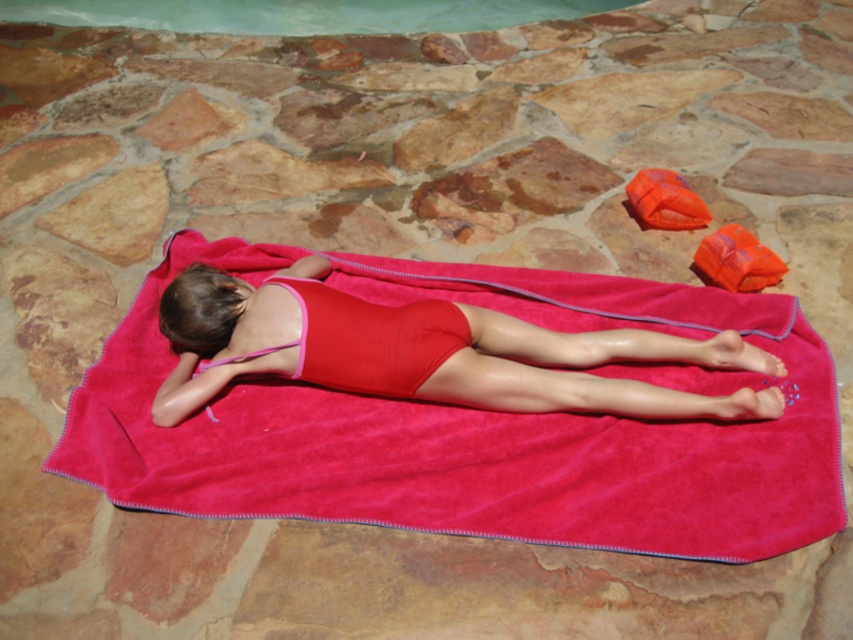
Question: Does matte pink towel at center have a smaller size compared to clear glass pool at upper center?

Choices:
 (A) yes
 (B) no

Answer: (B)

Question: Which point is farther from the camera taking this photo?

Choices:
 (A) (544, 10)
 (B) (541, 305)

Answer: (A)

Question: Which point is farther from the camera taking this photo?

Choices:
 (A) (682, 387)
 (B) (117, 13)

Answer: (B)

Question: Is matte pink towel at center bigger than matte red swimsuit at center?

Choices:
 (A) yes
 (B) no

Answer: (A)

Question: Is matte pink towel at center positioned at the back of matte red swimsuit at center?

Choices:
 (A) no
 (B) yes

Answer: (A)

Question: Based on their relative distances, which object is nearer to the matte red swimsuit at center?

Choices:
 (A) matte pink towel at center
 (B) clear glass pool at upper center

Answer: (A)